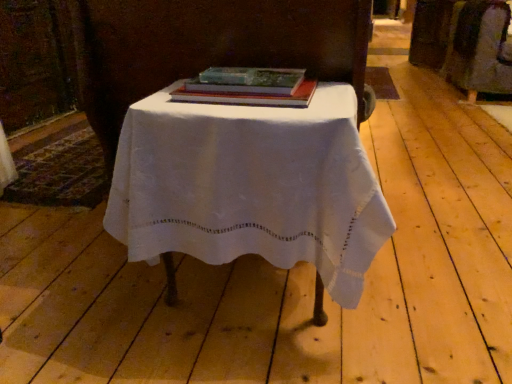
Identify the location of vacant space situated above translucent green glass book at center (from a real-world perspective). The image size is (512, 384). (253, 73).